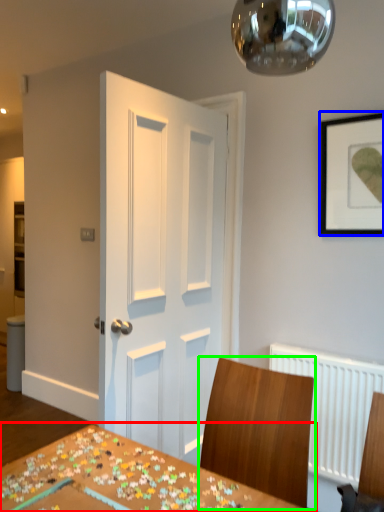
Question: Which object is positioned farthest from table (highlighted by a red box)? Select from picture frame (highlighted by a blue box) and chair (highlighted by a green box).

Choices:
 (A) picture frame
 (B) chair

Answer: (A)